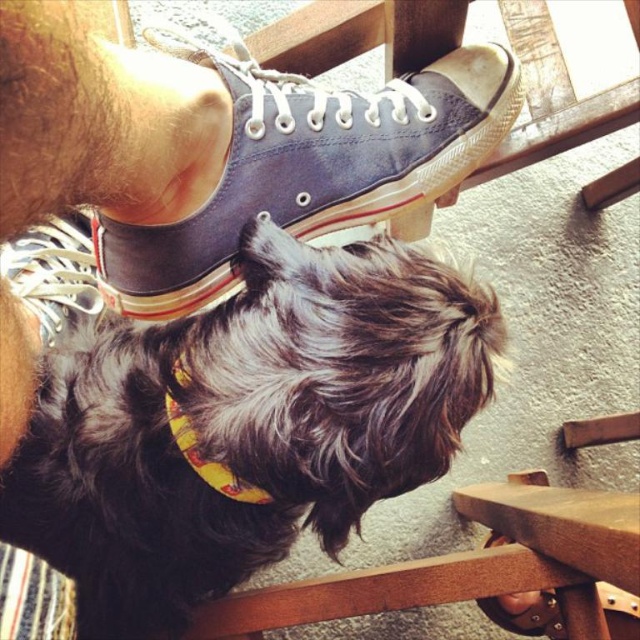
Does black fuzzy dog at lower left appear under yellow fabric neckband at center?

No.

Who is more distant from viewer, (68, 384) or (180, 424)?

The point (68, 384) is behind.

Image resolution: width=640 pixels, height=640 pixels. What are the coordinates of `black fuzzy dog at lower left` in the screenshot? It's located at (244, 422).

The height and width of the screenshot is (640, 640). In order to click on black fuzzy dog at lower left in this screenshot , I will do `click(244, 422)`.

Who is more distant from viewer, (362, 364) or (20, 262)?

The point (20, 262) is more distant.

Does black fuzzy dog at lower left appear on the right side of white lace-up shoe at lower left?

Indeed, black fuzzy dog at lower left is positioned on the right side of white lace-up shoe at lower left.

Does point (221, 552) come behind point (93, 314)?

No.

The height and width of the screenshot is (640, 640). Identify the location of black fuzzy dog at lower left. pos(244,422).

Is white lace-up shoe at lower left shorter than yellow fabric neckband at center?

No, white lace-up shoe at lower left is not shorter than yellow fabric neckband at center.

Is the position of white lace-up shoe at lower left less distant than that of yellow fabric neckband at center?

No, it is not.

Locate an element on the screen. white lace-up shoe at lower left is located at coordinates (54, 273).